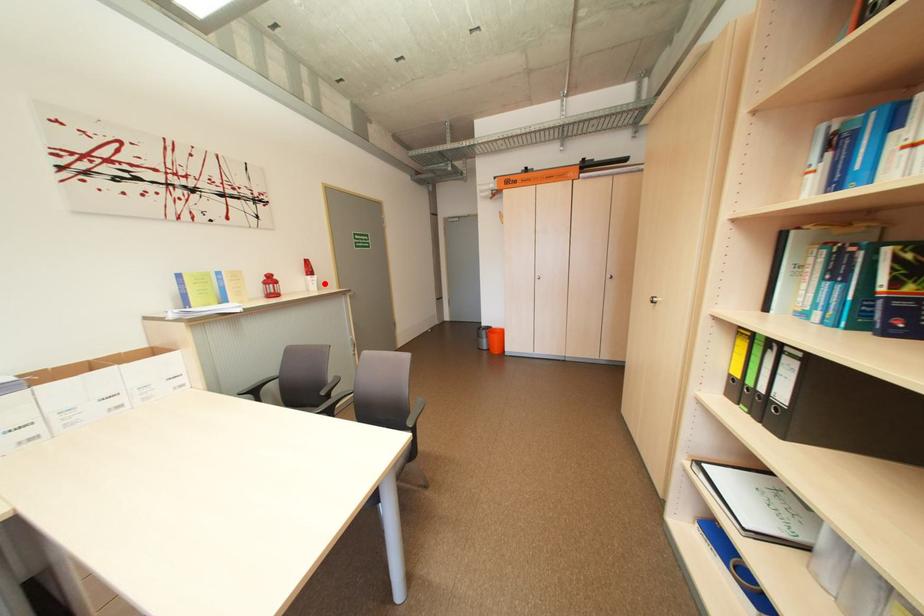
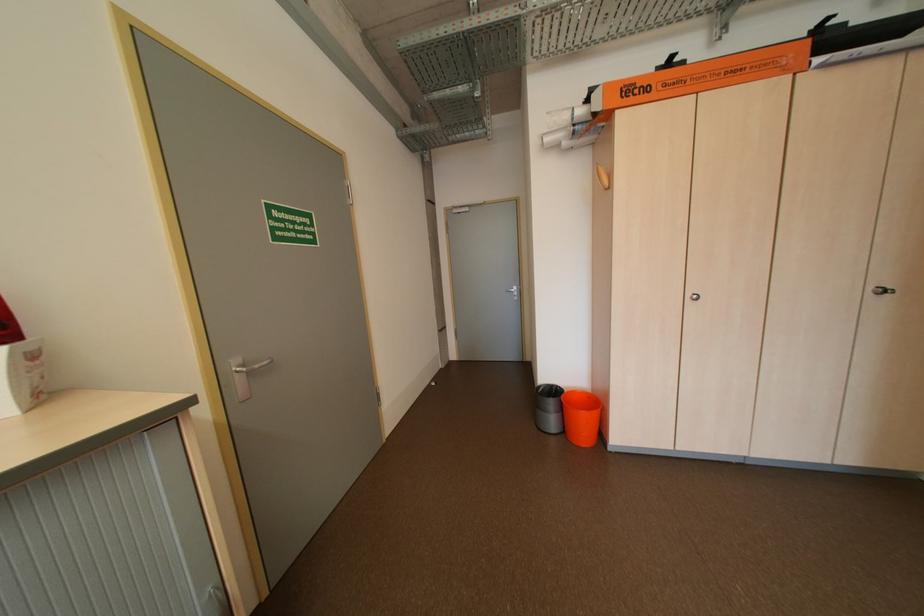
In the second image, find the point that corresponds to the highlighted location in the first image.

(6, 383)